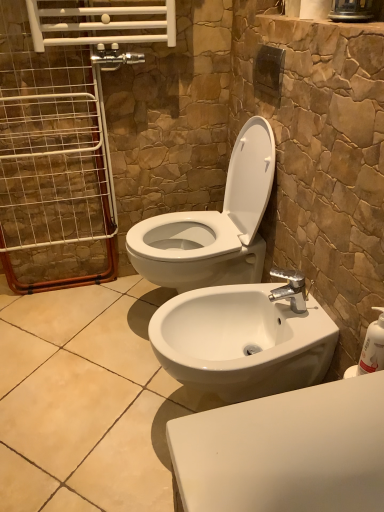
Question: Relative to white glossy toilet at center, is white glossy sink at lower center in front or behind?

Choices:
 (A) behind
 (B) front

Answer: (B)

Question: From a real-world perspective, is white glossy sink at lower center physically located above or below white glossy toilet at center?

Choices:
 (A) below
 (B) above

Answer: (A)

Question: Which of these objects is positioned closest to the white wire screen door at left?

Choices:
 (A) white glossy toilet at center
 (B) white plastic soap dispenser at right
 (C) white glossy sink at lower center

Answer: (A)

Question: Estimate the real-world distances between objects in this image. Which object is closer to the white wire screen door at left?

Choices:
 (A) white glossy toilet at center
 (B) white glossy sink at lower center
 (C) white plastic soap dispenser at right

Answer: (A)